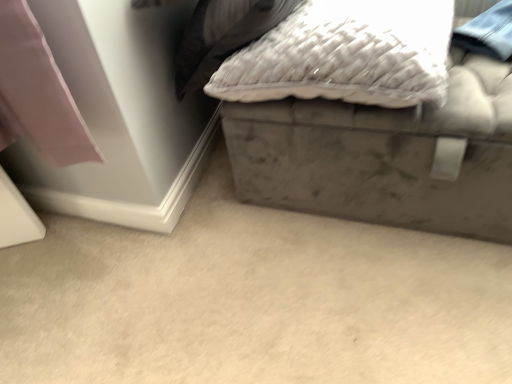
At what (x,y) coordinates should I click in order to perform the action: click on vacant area situated to the left side of velvet gray ottoman at upper right. Please return your answer as a coordinate pair (x, y). Image resolution: width=512 pixels, height=384 pixels. Looking at the image, I should click on (185, 263).